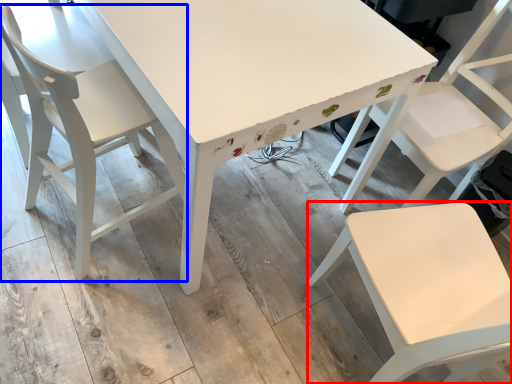
Question: Which object is closer to the camera taking this photo, chair (highlighted by a red box) or chair (highlighted by a blue box)?

Choices:
 (A) chair
 (B) chair

Answer: (A)